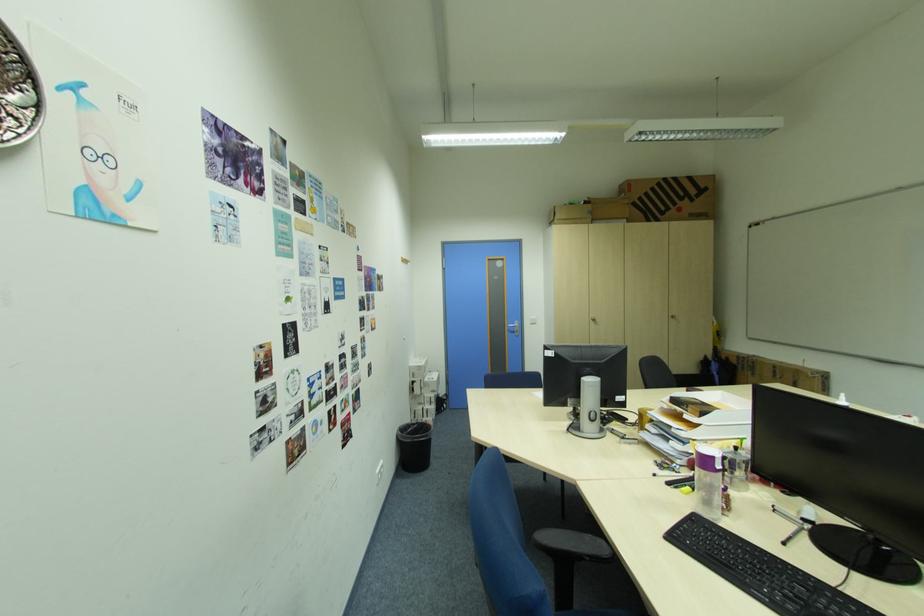
The height and width of the screenshot is (616, 924). Identify the location of blue chair armrest. (572, 544).